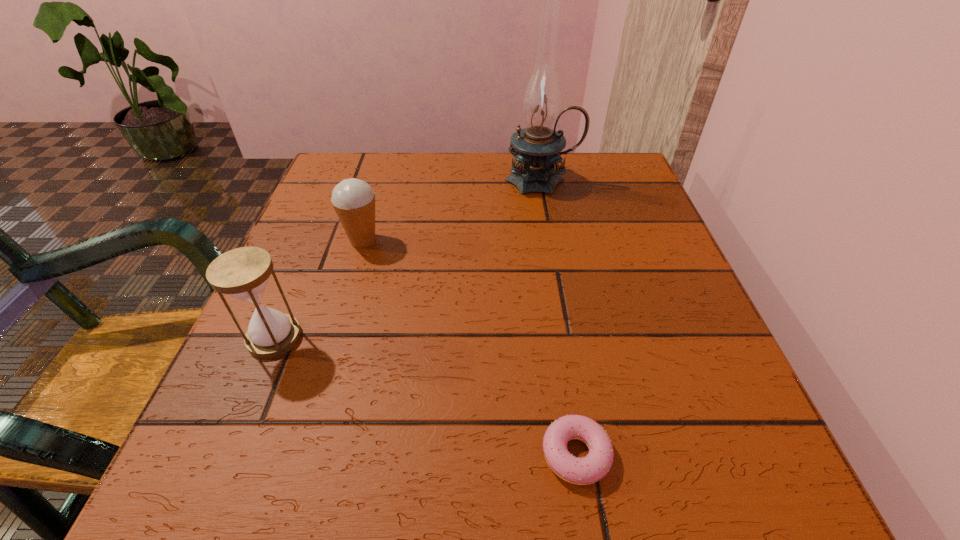
At what (x,y) coordinates should I click in order to perform the action: click on vacant region located 0.260m on the front of the second farthest object. Please return your answer as a coordinate pair (x, y). This screenshot has width=960, height=540. Looking at the image, I should click on (324, 369).

This screenshot has height=540, width=960. I want to click on vacant area situated on the right of the doughnut, so click(705, 454).

I want to click on object present at the far edge, so click(537, 148).

Where is `object at the near edge`? This screenshot has width=960, height=540. object at the near edge is located at coordinates (582, 471).

Where is `hourglass that is at the left edge`? This screenshot has width=960, height=540. hourglass that is at the left edge is located at coordinates (243, 273).

The image size is (960, 540). I want to click on icecream present at the left edge, so click(x=353, y=200).

This screenshot has height=540, width=960. Identify the location of object located at the right edge. (537, 148).

The height and width of the screenshot is (540, 960). What are the coordinates of `object present at the far right corner` in the screenshot? It's located at (537, 148).

Image resolution: width=960 pixels, height=540 pixels. In the image, there is a desktop. In order to click on vacant space at the far edge in this screenshot , I will do `click(465, 160)`.

I want to click on free region at the near edge of the desktop, so click(x=525, y=479).